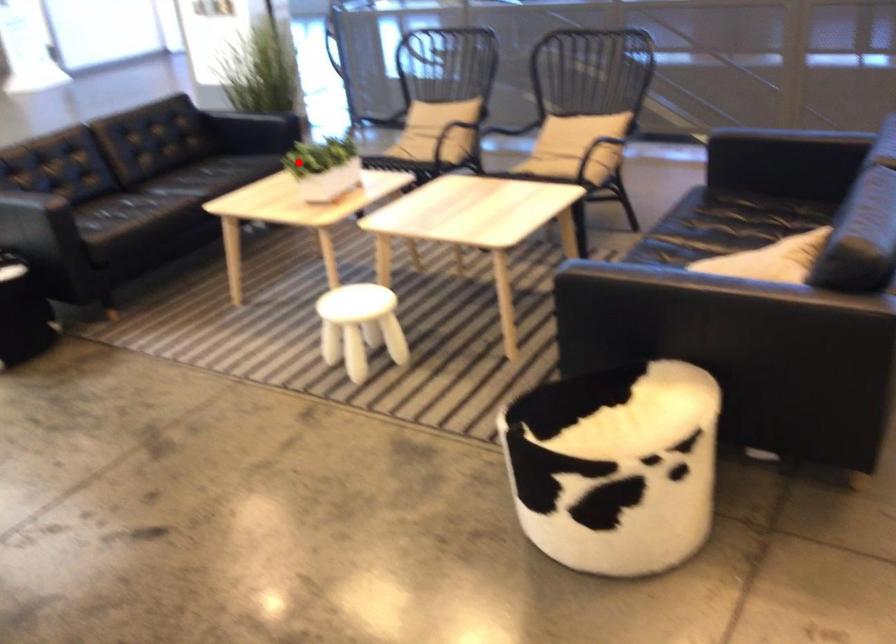
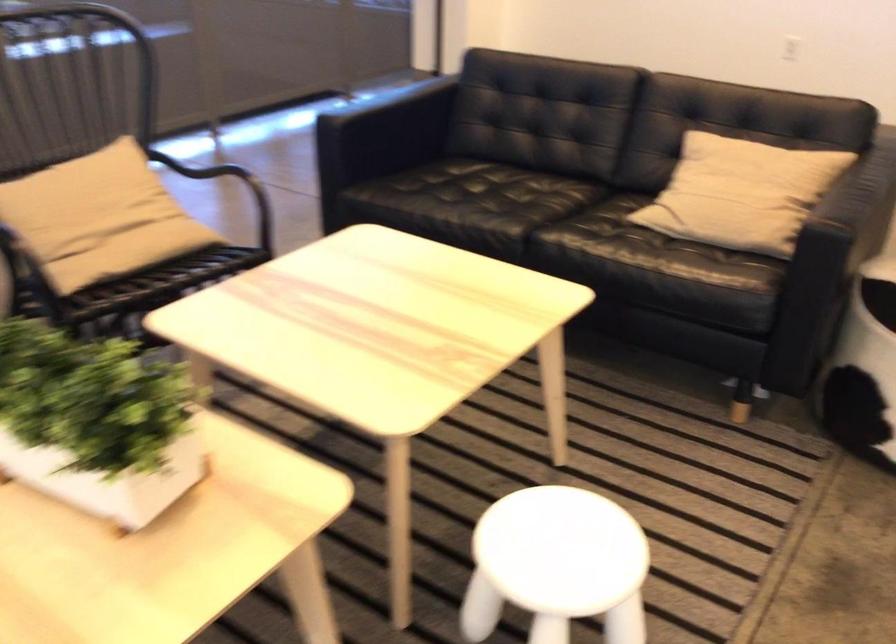
Question: I am providing you with two images of the same scene from different viewpoints. Image1 has a red point marked. In image2, the corresponding 3D location appears at what relative position? Reply with the corresponding letter.

Choices:
 (A) Closer
 (B) Farther

Answer: (A)